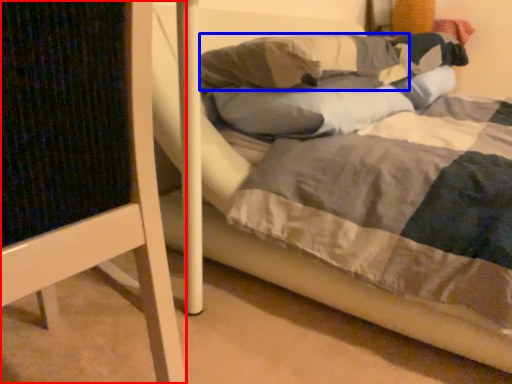
Question: Which object appears closest to the camera in this image, furniture (highlighted by a red box) or pillow (highlighted by a blue box)?

Choices:
 (A) furniture
 (B) pillow

Answer: (A)